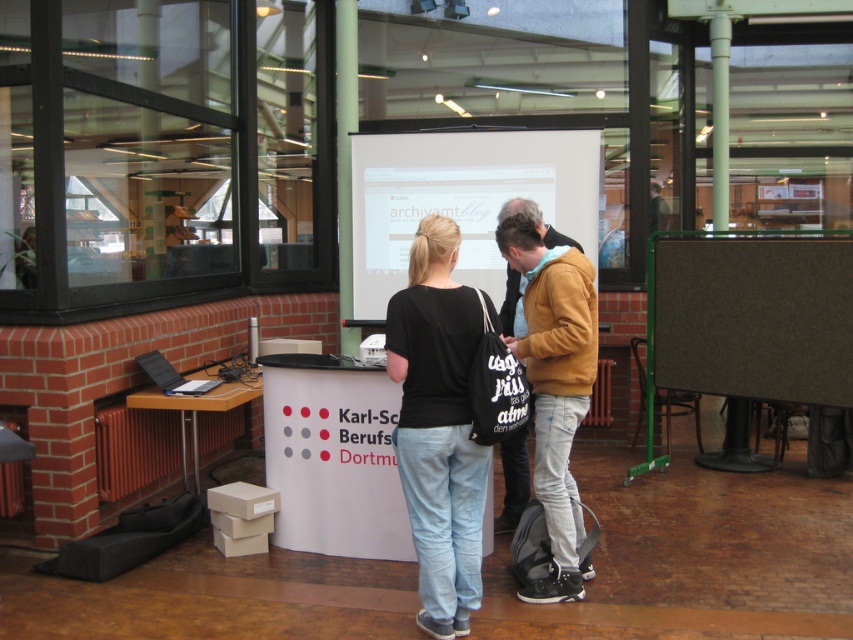
Question: Which of the following is the farthest from the observer?

Choices:
 (A) (512, 451)
 (B) (456, 566)

Answer: (A)

Question: Does black cotton shirt at center appear under matte yellow jacket at center?

Choices:
 (A) yes
 (B) no

Answer: (B)

Question: Which point is closer to the camera?

Choices:
 (A) matte yellow jacket at center
 (B) black cotton shirt at center

Answer: (B)

Question: Is black cotton shirt at center further to camera compared to matte yellow jacket at center?

Choices:
 (A) no
 (B) yes

Answer: (A)

Question: Is black cotton shirt at center to the left of matte yellow jacket at center from the viewer's perspective?

Choices:
 (A) yes
 (B) no

Answer: (A)